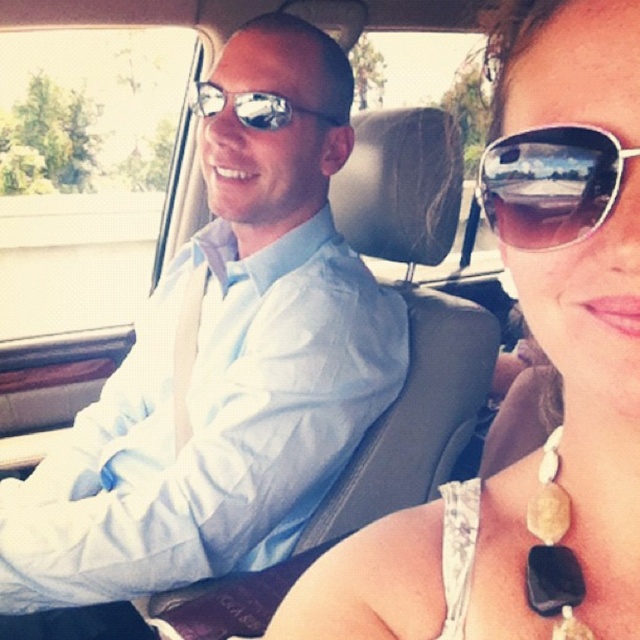
Does sunglasses at right appear on the left side of matte reflective sunglasses at center?

Incorrect, sunglasses at right is not on the left side of matte reflective sunglasses at center.

Is point (516, 161) in front of point (269, 96)?

Yes, point (516, 161) is closer to viewer.

At what (x,y) coordinates should I click in order to perform the action: click on sunglasses at right. Please return your answer as a coordinate pair (x, y). The image size is (640, 640). Looking at the image, I should click on (550, 184).

Which is below, matte white tank top at center or sunglasses at right?

matte white tank top at center is lower down.

Identify the location of matte white tank top at center. (548, 358).

Does matte light blue shirt at center appear under black stone necklace at lower right?

No, matte light blue shirt at center is not below black stone necklace at lower right.

Which is more to the right, matte light blue shirt at center or black stone necklace at lower right?

Positioned to the right is black stone necklace at lower right.

Which is in front, point (132, 518) or point (568, 632)?

Point (568, 632)

This screenshot has height=640, width=640. Identify the location of matte light blue shirt at center. (221, 365).